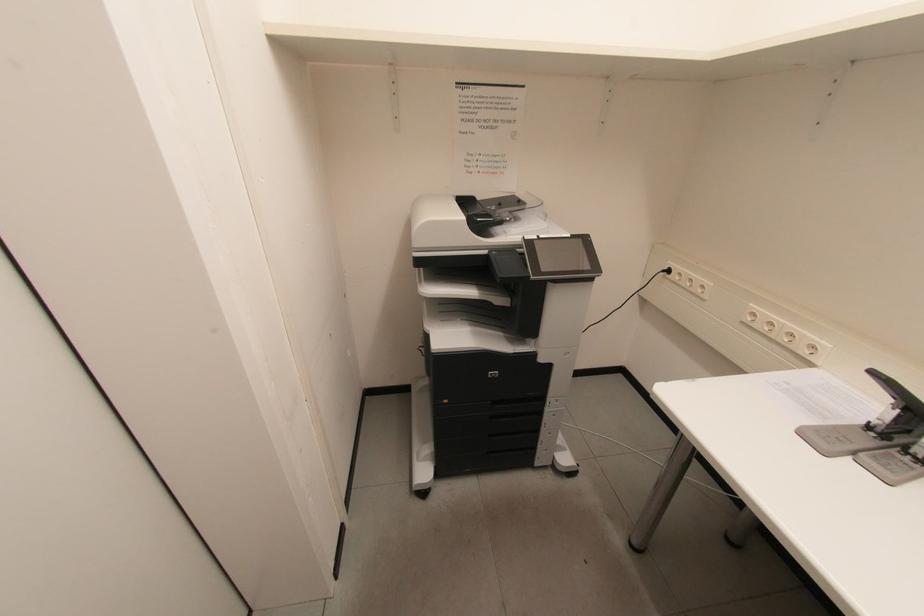
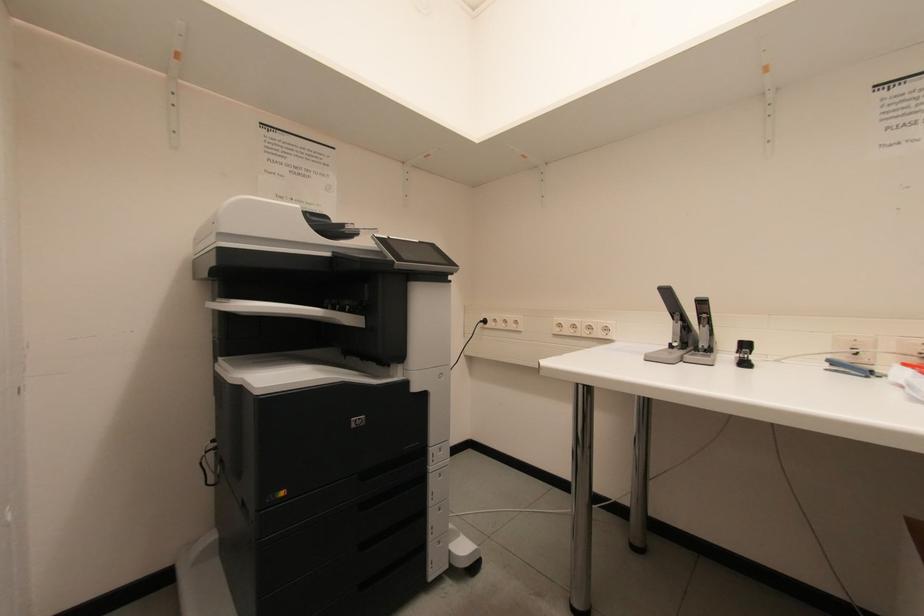
The images are taken continuously from a first-person perspective. In which direction is your viewpoint rotating?

The camera rotated toward right-up.